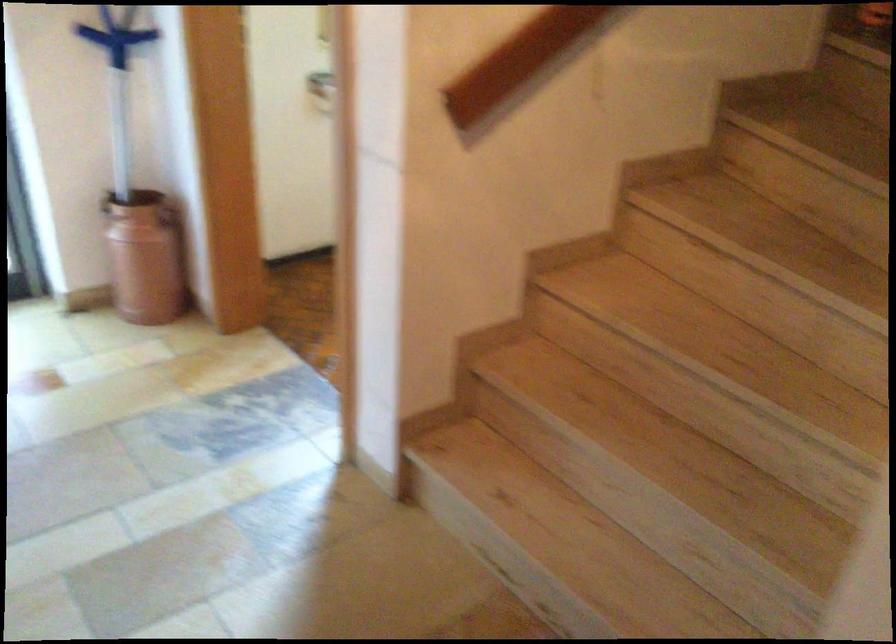
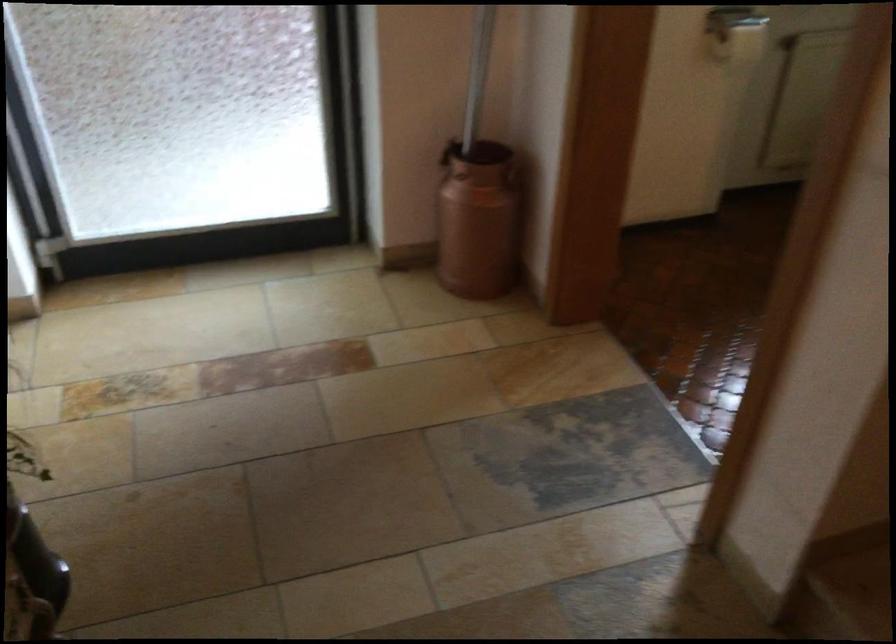
The point at (169, 214) is marked in the first image. Where is the corresponding point in the second image?

(513, 176)